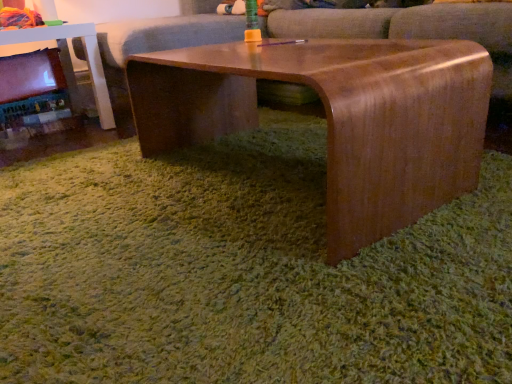
Question: Is matte black fireplace at left further to the viewer compared to satin wood coffee table at center?

Choices:
 (A) no
 (B) yes

Answer: (B)

Question: Does matte black fireplace at left have a lesser width compared to satin wood coffee table at center?

Choices:
 (A) yes
 (B) no

Answer: (A)

Question: From a real-world perspective, does matte black fireplace at left stand above satin wood coffee table at center?

Choices:
 (A) no
 (B) yes

Answer: (A)

Question: Can you confirm if matte black fireplace at left is taller than satin wood coffee table at center?

Choices:
 (A) yes
 (B) no

Answer: (A)

Question: Is matte black fireplace at left closer to the viewer compared to satin wood coffee table at center?

Choices:
 (A) yes
 (B) no

Answer: (B)

Question: Is wooden table at left bigger or smaller than matte black fireplace at left?

Choices:
 (A) big
 (B) small

Answer: (A)

Question: From a real-world perspective, is wooden table at left physically located above or below matte black fireplace at left?

Choices:
 (A) above
 (B) below

Answer: (A)

Question: In the image, is wooden table at left positioned in front of or behind matte black fireplace at left?

Choices:
 (A) behind
 (B) front

Answer: (B)

Question: Would you say wooden table at left is to the left or to the right of matte black fireplace at left in the picture?

Choices:
 (A) right
 (B) left

Answer: (A)

Question: Is satin wood coffee table at center bigger or smaller than wooden table at left?

Choices:
 (A) big
 (B) small

Answer: (A)

Question: From a real-world perspective, is satin wood coffee table at center positioned above or below wooden table at left?

Choices:
 (A) below
 (B) above

Answer: (A)

Question: Would you say satin wood coffee table at center is inside or outside wooden table at left?

Choices:
 (A) inside
 (B) outside

Answer: (B)

Question: Considering the positions of satin wood coffee table at center and wooden table at left in the image, is satin wood coffee table at center wider or thinner than wooden table at left?

Choices:
 (A) wide
 (B) thin

Answer: (B)

Question: Considering the positions of wooden table at left and wooden couch at center in the image, is wooden table at left taller or shorter than wooden couch at center?

Choices:
 (A) tall
 (B) short

Answer: (B)

Question: Based on their sizes in the image, would you say wooden table at left is bigger or smaller than wooden couch at center?

Choices:
 (A) small
 (B) big

Answer: (A)